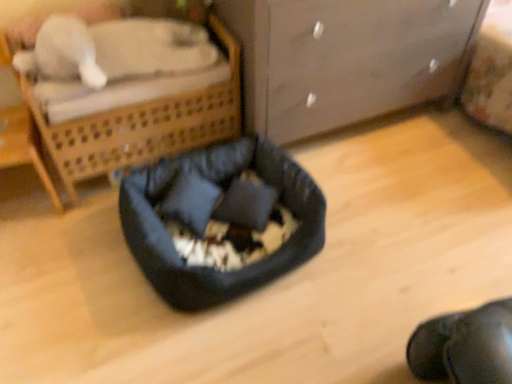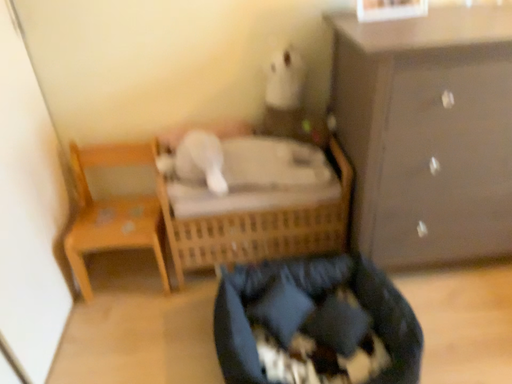
Question: Which way did the camera rotate in the video?

Choices:
 (A) rotated downward
 (B) rotated upward

Answer: (B)